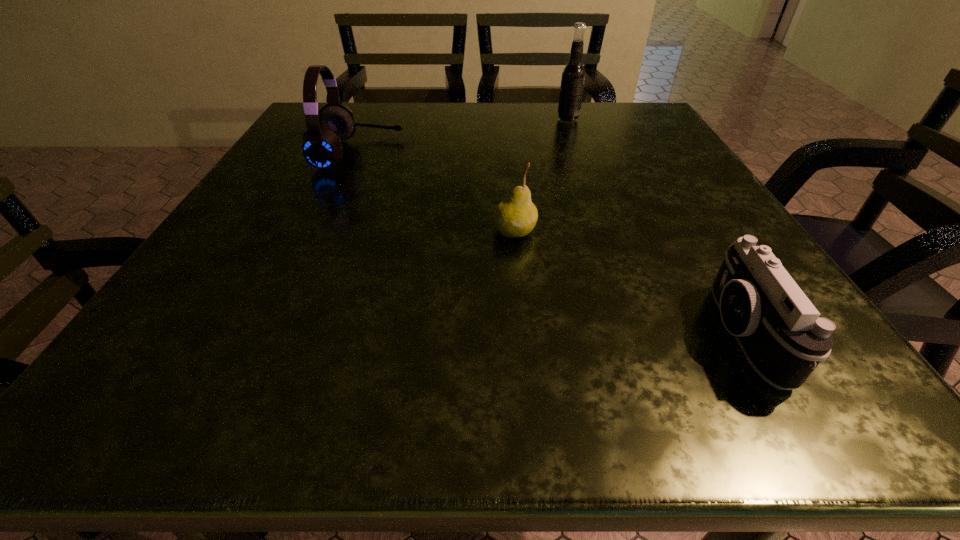
This screenshot has height=540, width=960. I want to click on vacant space at the near right corner of the desktop, so click(847, 410).

Where is `free space that is in between the nearest object and the root beer`? The width and height of the screenshot is (960, 540). free space that is in between the nearest object and the root beer is located at coordinates (655, 227).

Image resolution: width=960 pixels, height=540 pixels. What are the coordinates of `free spot between the headset and the camera` in the screenshot? It's located at (550, 244).

Where is `vacant space that's between the pear and the headset`? The width and height of the screenshot is (960, 540). vacant space that's between the pear and the headset is located at coordinates (436, 192).

Identify the location of vacant area between the second object from left to right and the second tallest object. (436, 192).

I want to click on vacant space that's between the farthest object and the second farthest object, so click(x=463, y=137).

Find the location of `vacant area that lies between the camera and the third object from left to right`. vacant area that lies between the camera and the third object from left to right is located at coordinates [x=655, y=227].

Find the location of a particular element. The width and height of the screenshot is (960, 540). free space between the leftmost object and the third object from left to right is located at coordinates (463, 137).

This screenshot has width=960, height=540. Identify the location of blank region between the leftmost object and the tallest object. (463, 137).

Image resolution: width=960 pixels, height=540 pixels. What are the coordinates of `empty location between the leftmost object and the farthest object` in the screenshot? It's located at (463, 137).